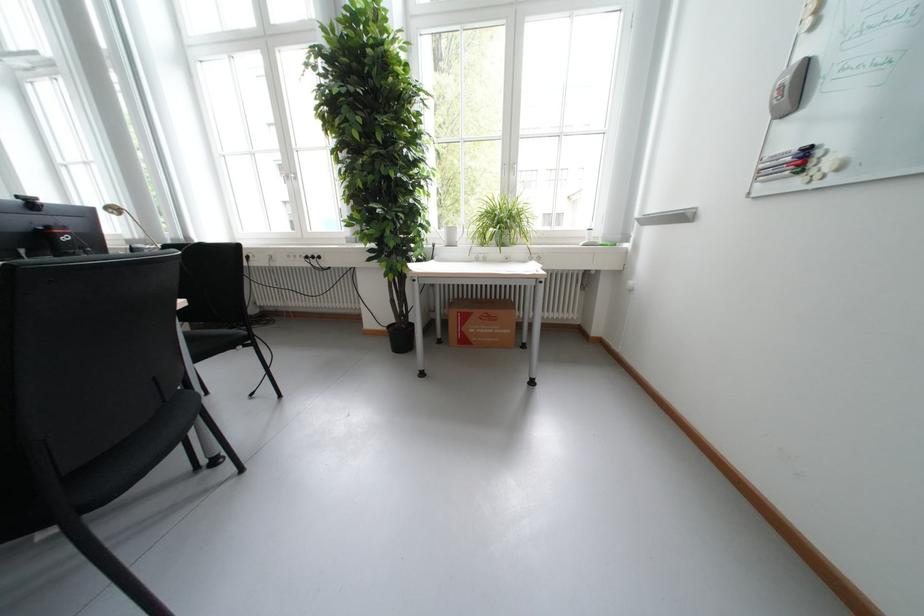
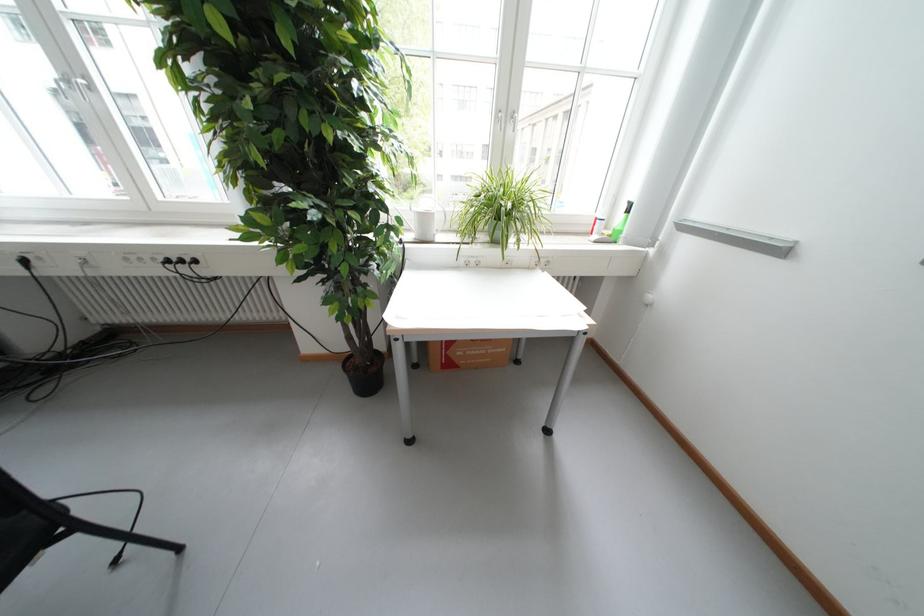
Question: How did the camera likely rotate?

Choices:
 (A) Left
 (B) Right
 (C) Up
 (D) Down

Answer: (B)